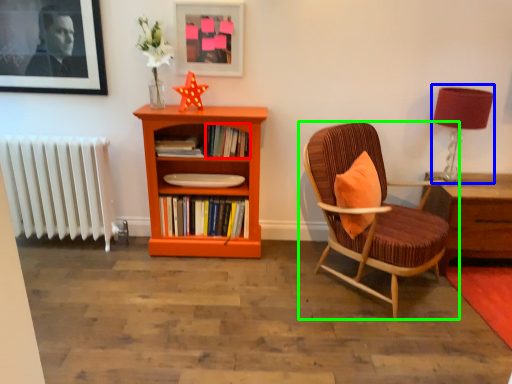
Question: Estimate the real-world distances between objects in this image. Which object is farther from book (highlighted by a red box), table lamp (highlighted by a blue box) or chair (highlighted by a green box)?

Choices:
 (A) table lamp
 (B) chair

Answer: (A)